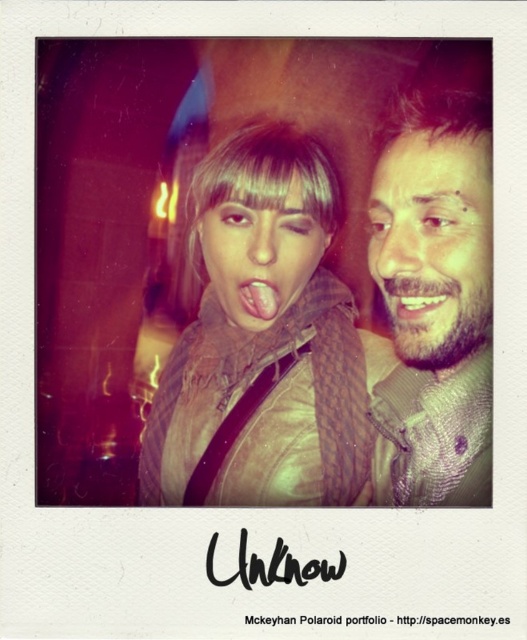
Question: Which of these objects is positioned farthest from the matte skin face at center?

Choices:
 (A) bearded man at right
 (B) pink flesh-colored lips at center
 (C) white glossy teeth at center

Answer: (C)

Question: Does matte skin face at center lie in front of white glossy teeth at center?

Choices:
 (A) yes
 (B) no

Answer: (B)

Question: Is matte brown scarf at center below bearded man at right?

Choices:
 (A) yes
 (B) no

Answer: (A)

Question: Which point is farther from the camera taking this photo?

Choices:
 (A) (393, 224)
 (B) (261, 323)
 (C) (437, 292)
 (D) (457, 483)

Answer: (B)

Question: Can you confirm if bearded man at right is positioned to the left of pink flesh-colored lips at center?

Choices:
 (A) no
 (B) yes

Answer: (A)

Question: Which object appears farthest from the camera in this image?

Choices:
 (A) pink flesh-colored lips at center
 (B) white glossy teeth at center
 (C) matte skin face at center
 (D) bearded man at right

Answer: (A)